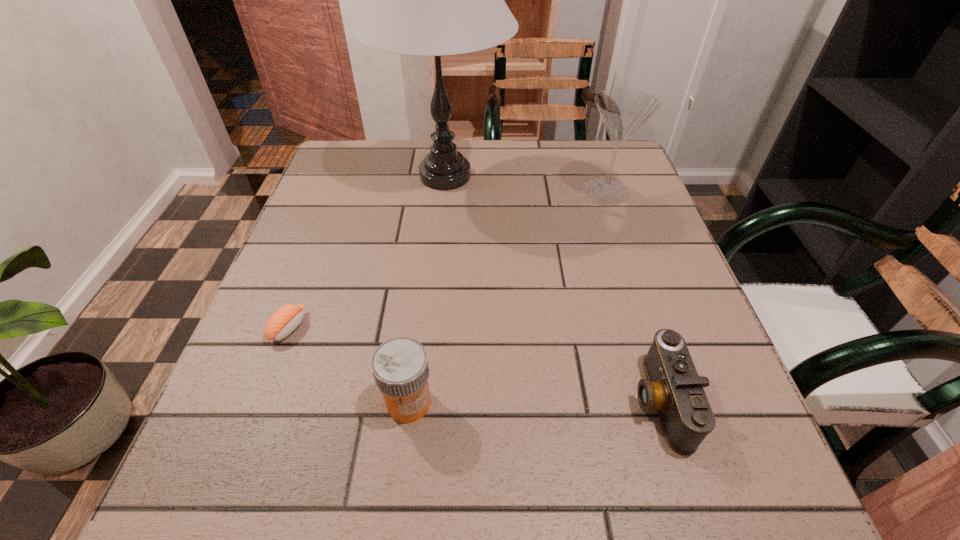
Identify which object is located as the fourth nearest to the tallest object. Please provide its 2D coordinates. Your answer should be formatted as a tuple, i.e. [(x, y)], where the tuple contains the x and y coordinates of a point satisfying the conditions above.

[(400, 368)]

Locate which object is the fourth closest to the fourth shortest object. Please provide its 2D coordinates. Your answer should be formatted as a tuple, i.e. [(x, y)], where the tuple contains the x and y coordinates of a point satisfying the conditions above.

[(284, 321)]

At what (x,y) coordinates should I click in order to perform the action: click on vacant space that satisfies the following two spatial constraints: 1. on the back side of the tallest object; 2. on the right side of the sushi. Please return your answer as a coordinate pair (x, y). The image size is (960, 540). Looking at the image, I should click on (346, 176).

At what (x,y) coordinates should I click in order to perform the action: click on vacant space that satisfies the following two spatial constraints: 1. on the lens of the fourth tallest object; 2. on the label side of the third tallest object. Please return your answer as a coordinate pair (x, y). This screenshot has height=540, width=960. Looking at the image, I should click on (660, 402).

This screenshot has height=540, width=960. I want to click on free space that satisfies the following two spatial constraints: 1. on the front side of the fourth shortest object; 2. on the lens of the camera, so click(x=677, y=401).

Identify the location of free location that satisfies the following two spatial constraints: 1. on the lens of the camera; 2. on the label side of the third tallest object. The width and height of the screenshot is (960, 540). (660, 402).